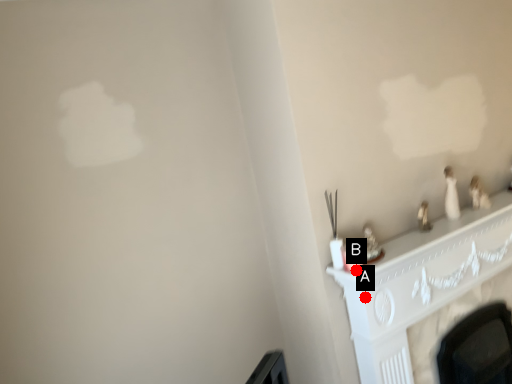
Question: Two points are circled on the image, labeled by A and B beside each circle. Which point is closer to the camera?

Choices:
 (A) A is closer
 (B) B is closer

Answer: (B)